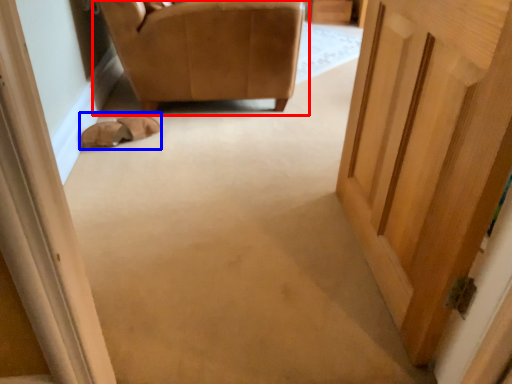
Question: Which point is further to the camera, chair (highlighted by a red box) or shoe (highlighted by a blue box)?

Choices:
 (A) chair
 (B) shoe

Answer: (B)